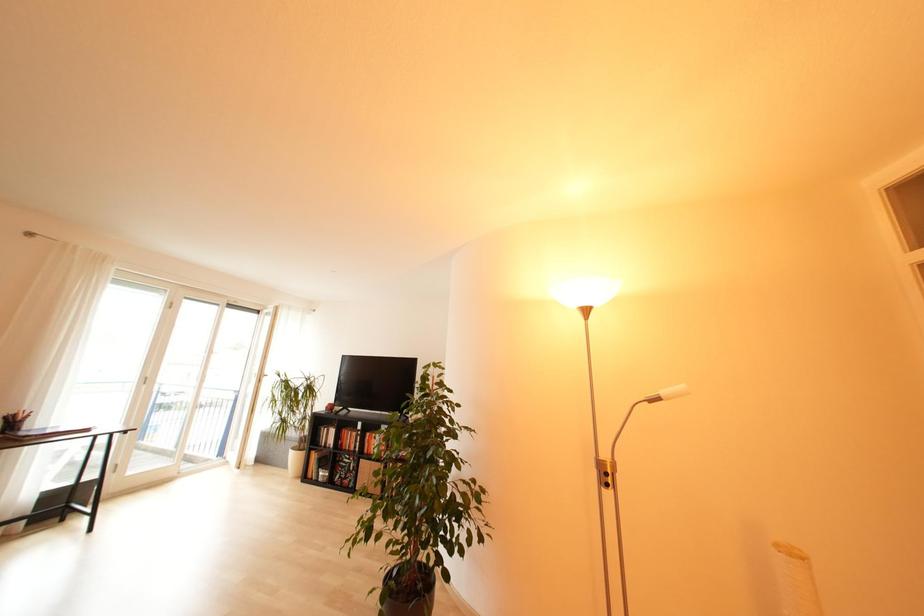
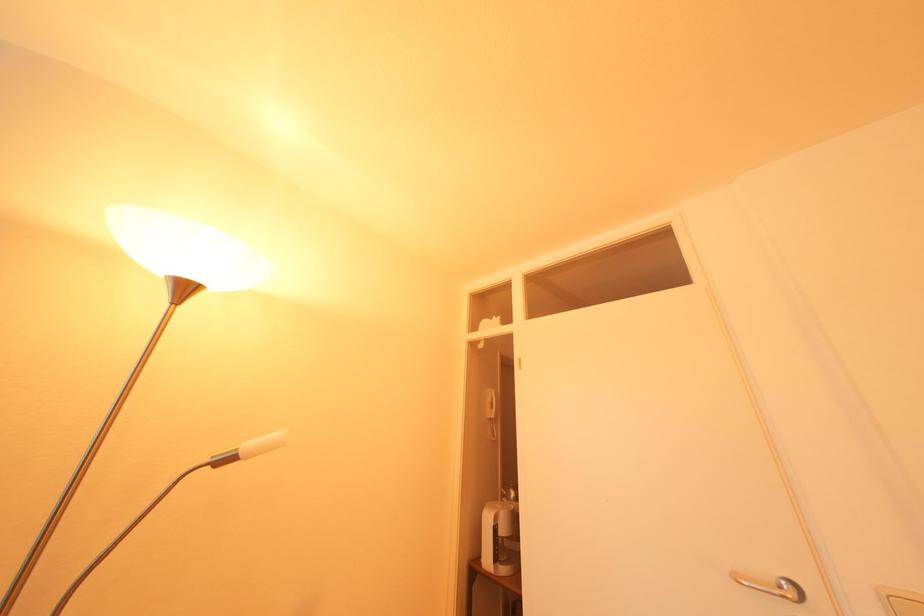
Question: The camera is either moving clockwise (left) or counter-clockwise (right) around the object. The first image is from the beginning of the video and the second image is from the end. Is the camera moving left or right when shooting the video?

Choices:
 (A) Left
 (B) Right

Answer: (A)